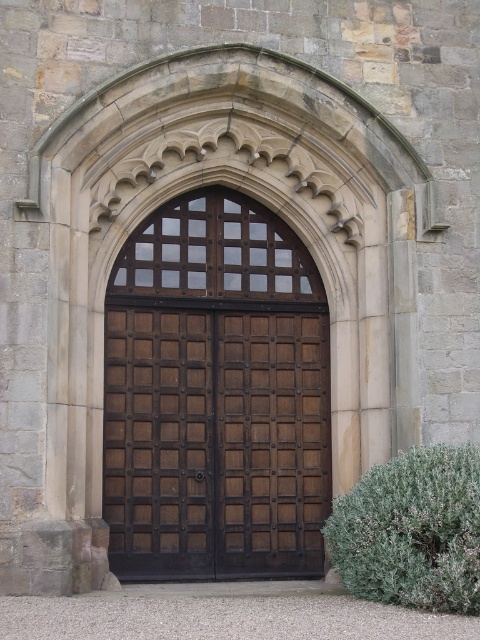
Between brown wooden door at center and green leafy bush at lower right, which one has more height?

With more height is brown wooden door at center.

Which is below, brown wooden door at center or green leafy bush at lower right?

green leafy bush at lower right

Identify the location of brown wooden door at center. The width and height of the screenshot is (480, 640). (216, 396).